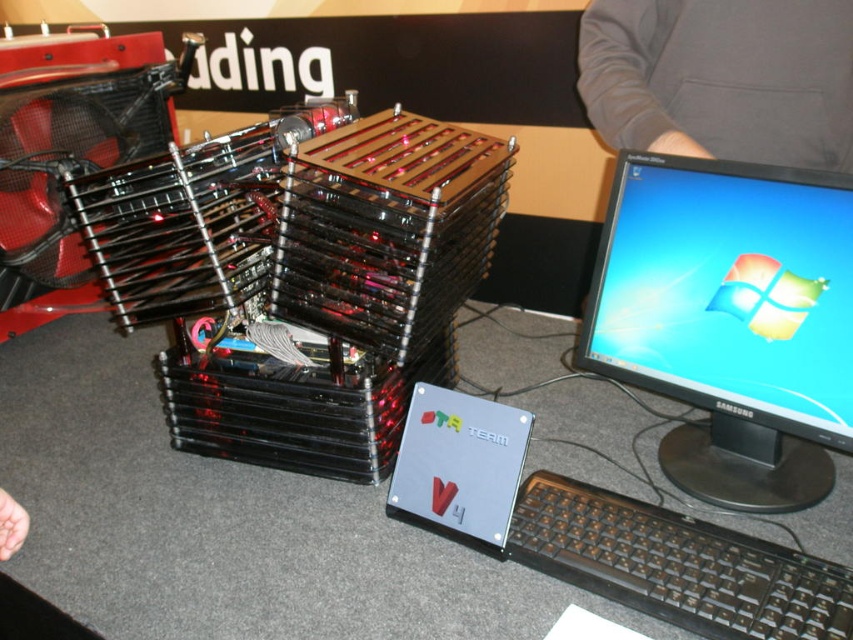
You are a tech enthusiast at the exhibition and want to place your laptop on the black plastic table at center. However, you notice the silver metallic hard drive at center is already occupying space on it. Can you estimate if the table has enough vertical space to accommodate both the hard drive and your laptop without the laptop touching the floor?

The black plastic table at center is much taller than the silver metallic hard drive at center, so there is sufficient vertical space to place both items on the table without the laptop touching the floor.

You are at a tech exhibition and notice the silver metallic hard drive at center and the gray fabric sleeve at upper right. Which object is positioned lower in the image?

The silver metallic hard drive at center is located below the gray fabric sleeve at upper right, so it is positioned lower in the image.

You are at a tech exhibition and see the custom computer setup. There is a black plastic table at center and a gray fabric sleeve at upper right. Which object is positioned to the left of the other?

The black plastic table at center is to the left of gray fabric sleeve at upper right.